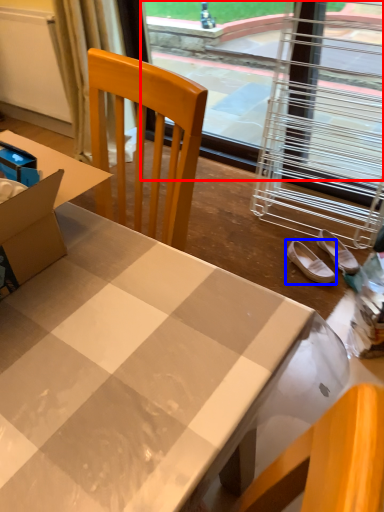
Question: Which object appears closest to the camera in this image, window screen (highlighted by a red box) or footwear (highlighted by a blue box)?

Choices:
 (A) window screen
 (B) footwear

Answer: (B)